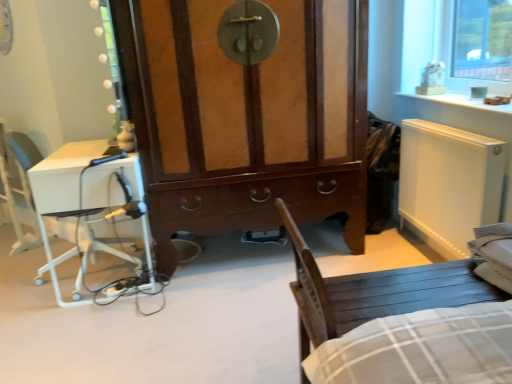
Identify the location of vacant space in front of brown wood cabinet at center. (198, 323).